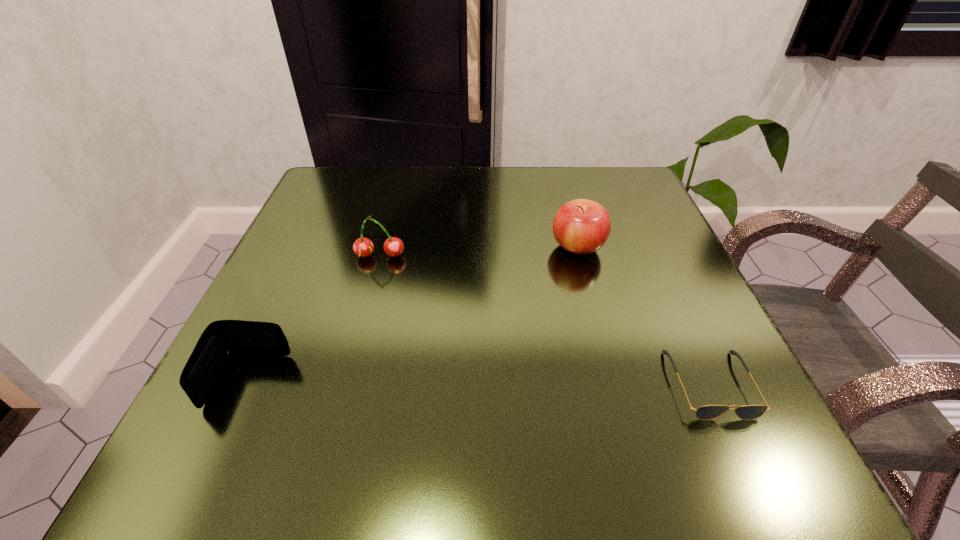
Locate an element on the screen. This screenshot has width=960, height=540. free space that is in between the second object from right to left and the shortest object is located at coordinates (644, 315).

You are a GUI agent. You are given a task and a screenshot of the screen. Output one action in this format:
    pyautogui.click(x=<x>, y=<y>)
    Task: Click on the object identified as the third closest to the second object from left to right
    
    Given the screenshot: What is the action you would take?
    pyautogui.click(x=707, y=412)

You are a GUI agent. You are given a task and a screenshot of the screen. Output one action in this format:
    pyautogui.click(x=<x>, y=<y>)
    Task: Click on the object that is the third closest to the shortest object
    The width and height of the screenshot is (960, 540).
    Given the screenshot: What is the action you would take?
    pyautogui.click(x=221, y=339)